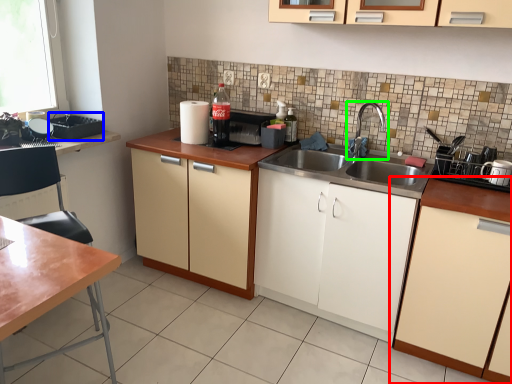
Question: Which object is positioned closest to cabinetry (highlighted by a red box)? Select from appliance (highlighted by a blue box) and tap (highlighted by a green box).

Choices:
 (A) appliance
 (B) tap

Answer: (B)